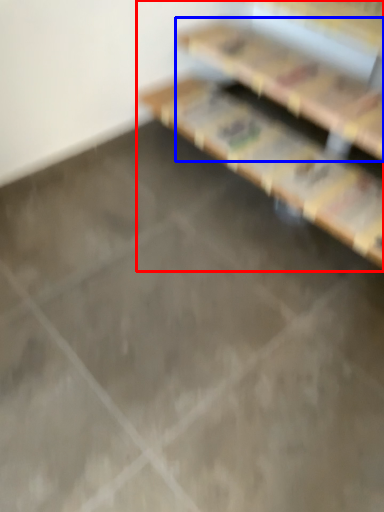
Question: Among these objects, which one is nearest to the camera, furniture (highlighted by a red box) or shelf (highlighted by a blue box)?

Choices:
 (A) furniture
 (B) shelf

Answer: (A)